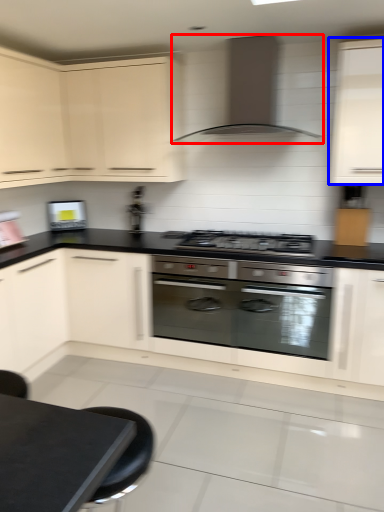
Question: Among these objects, which one is farthest to the camera, home appliance (highlighted by a red box) or cabinetry (highlighted by a blue box)?

Choices:
 (A) home appliance
 (B) cabinetry

Answer: (A)